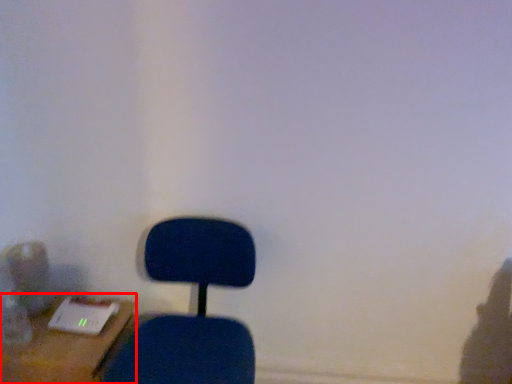
Question: Considering the relative positions of furniture (annotated by the red box) and chair in the image provided, where is furniture (annotated by the red box) located with respect to the staircase?

Choices:
 (A) left
 (B) right

Answer: (A)